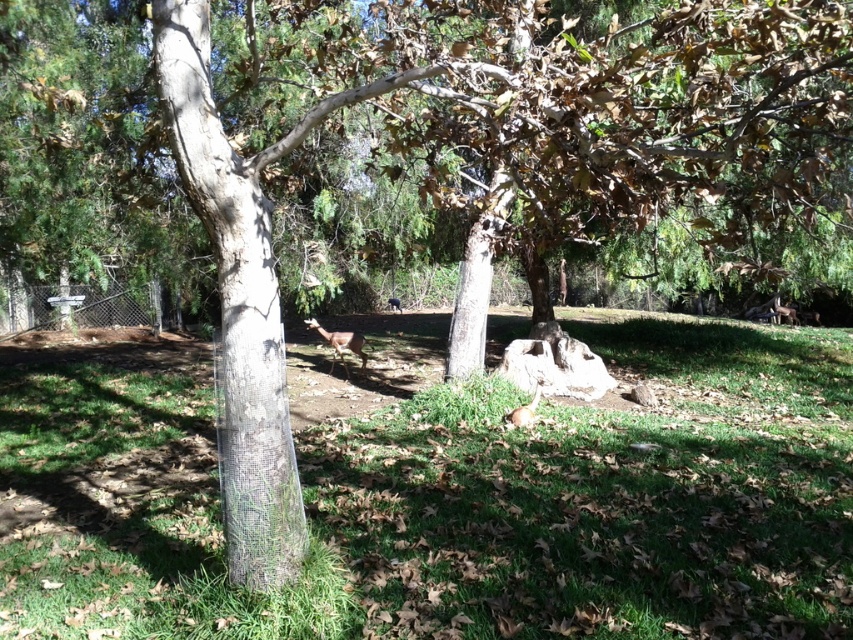
Based on the photo, you are standing in the park and see the green grassy at center and the brown fur deer at center. Which object is lower in position?

The green grassy at center is below the brown fur deer at center, so the green grassy at center is lower in position.

You are a photographer setting up a shot in the park. You have a clear plastic tree trunk at left and a brown furry rabbit at center in your viewfinder. Which object is positioned more to the left?

The clear plastic tree trunk at left is more to the left than the brown furry rabbit at center because it is positioned on the left side of the brown furry rabbit at center.